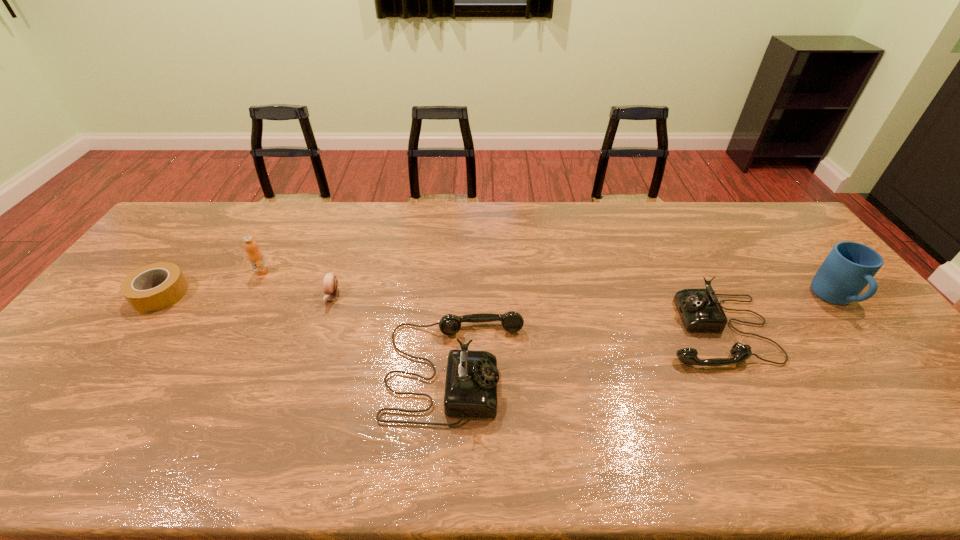
Image resolution: width=960 pixels, height=540 pixels. Identify the location of free point at the far edge. (227, 217).

Where is `vacant space at the near edge of the desktop`? Image resolution: width=960 pixels, height=540 pixels. vacant space at the near edge of the desktop is located at coordinates (80, 411).

Find the location of a particular element. The width and height of the screenshot is (960, 540). blank area at the left edge is located at coordinates (175, 242).

The height and width of the screenshot is (540, 960). In the image, there is a desktop. Identify the location of vacant space at the right edge. (792, 242).

This screenshot has width=960, height=540. Find the location of `blank space at the far right corner of the desktop`. blank space at the far right corner of the desktop is located at coordinates (778, 213).

You are a GUI agent. You are given a task and a screenshot of the screen. Output one action in this format:
    pyautogui.click(x=<x>, y=<y>)
    Task: Click on the unoccupied area between the left telephone and the second object from left to right
    
    Given the screenshot: What is the action you would take?
    pyautogui.click(x=359, y=320)

The image size is (960, 540). In order to click on free space between the second object from left to right and the shorter telephone in this screenshot , I will do `click(489, 300)`.

Identify the location of unoccupied area between the duct tape and the taller telephone. The height and width of the screenshot is (540, 960). (308, 332).

Where is `free space between the fourth tallest object and the farthest object`? This screenshot has height=540, width=960. free space between the fourth tallest object and the farthest object is located at coordinates (489, 300).

Where is `free space between the taller telephone and the third shortest object`? The image size is (960, 540). free space between the taller telephone and the third shortest object is located at coordinates (586, 349).